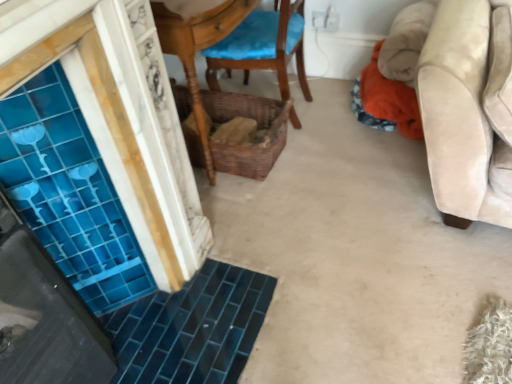
Question: In the image, is woven brown basket at center positioned in front of or behind wooden chair with blue cushion at center?

Choices:
 (A) behind
 (B) front

Answer: (A)

Question: Is point (262, 110) positioned closer to the camera than point (262, 39)?

Choices:
 (A) farther
 (B) closer

Answer: (A)

Question: Would you say woven brown basket at center is inside or outside wooden chair with blue cushion at center?

Choices:
 (A) outside
 (B) inside

Answer: (A)

Question: From the image's perspective, is wooden chair with blue cushion at center above or below woven brown basket at center?

Choices:
 (A) below
 (B) above

Answer: (B)

Question: Is wooden chair with blue cushion at center inside the boundaries of woven brown basket at center, or outside?

Choices:
 (A) outside
 (B) inside

Answer: (A)

Question: Does point (285, 66) appear closer or farther from the camera than point (222, 107)?

Choices:
 (A) closer
 (B) farther

Answer: (A)

Question: In the image, is wooden chair with blue cushion at center on the left side or the right side of woven brown basket at center?

Choices:
 (A) right
 (B) left

Answer: (A)